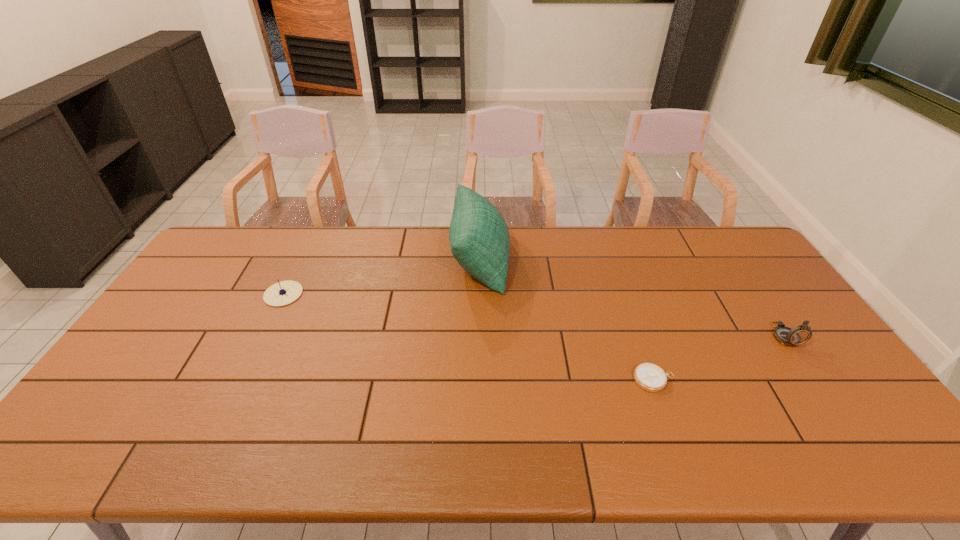
I want to click on vacant region located on the right of the third tallest object, so click(x=343, y=294).

At what (x,y) coordinates should I click in order to perform the action: click on vacant space situated on the back of the shortest object. Please return your answer as a coordinate pair (x, y). Looking at the image, I should click on (620, 283).

The width and height of the screenshot is (960, 540). I want to click on object that is at the far edge, so click(479, 238).

The width and height of the screenshot is (960, 540). In order to click on object that is at the right edge in this screenshot , I will do `click(800, 334)`.

Image resolution: width=960 pixels, height=540 pixels. Find the location of `free spot at the far edge of the desktop`. free spot at the far edge of the desktop is located at coordinates (273, 240).

This screenshot has width=960, height=540. In order to click on free region at the near edge in this screenshot , I will do `click(775, 442)`.

At what (x,y) coordinates should I click in order to perform the action: click on free spot at the left edge of the desktop. Please return your answer as a coordinate pair (x, y). Looking at the image, I should click on (156, 332).

Locate an element on the screen. This screenshot has width=960, height=540. free location at the right edge is located at coordinates (772, 295).

Identify the location of free space at the near right corner. (868, 452).

Locate an element on the screen. The image size is (960, 540). free space between the second tallest object and the second object from right to left is located at coordinates (719, 357).